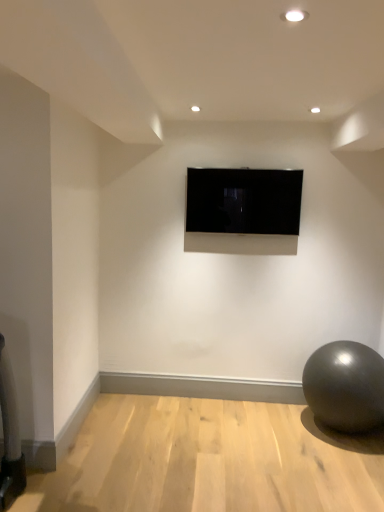
Locate an element on the screen. free point above black glossy tv at center (from a real-world perspective) is located at coordinates (250, 164).